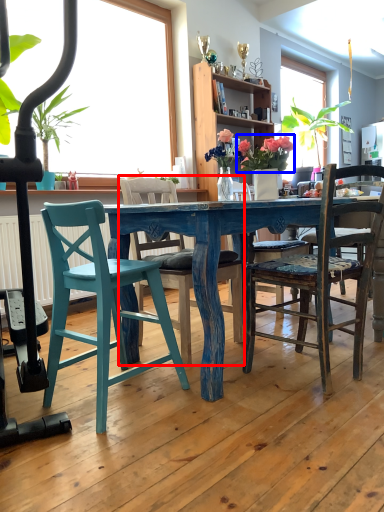
Question: Which of the following is the farthest to the observer, chair (highlighted by a red box) or floral arrangement (highlighted by a blue box)?

Choices:
 (A) chair
 (B) floral arrangement

Answer: (B)